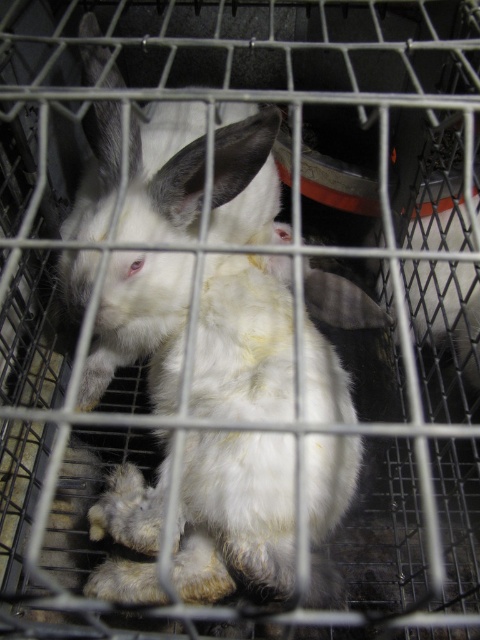
Where is `white fluffy rabbit at center`? Image resolution: width=480 pixels, height=640 pixels. white fluffy rabbit at center is located at coordinates (235, 513).

Who is more distant from viewer, (266, 433) or (417, 262)?

The point (417, 262) is behind.

You are a GUI agent. You are given a task and a screenshot of the screen. Output one action in this format:
    pyautogui.click(x=<x>, y=<y>)
    Task: Click on the white fluffy rabbit at center
    The image size is (480, 640).
    Given the screenshot: What is the action you would take?
    pyautogui.click(x=235, y=513)